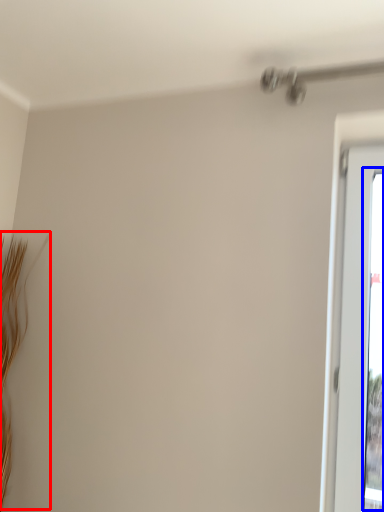
Question: Which object is further to the camera taking this photo, twig (highlighted by a red box) or window screen (highlighted by a blue box)?

Choices:
 (A) twig
 (B) window screen

Answer: (A)